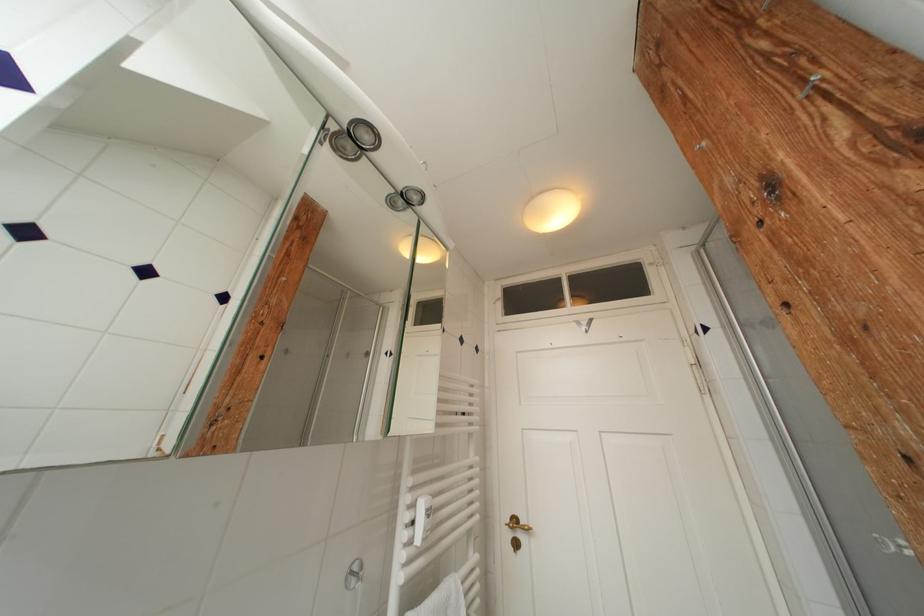
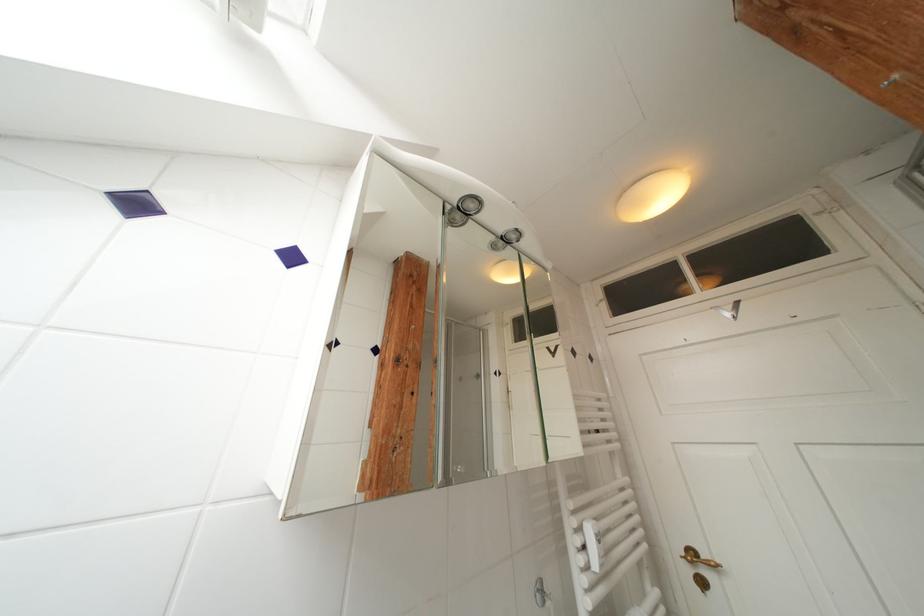
Where in the second image is the point corresponding to (x=270, y=326) from the first image?

(412, 370)